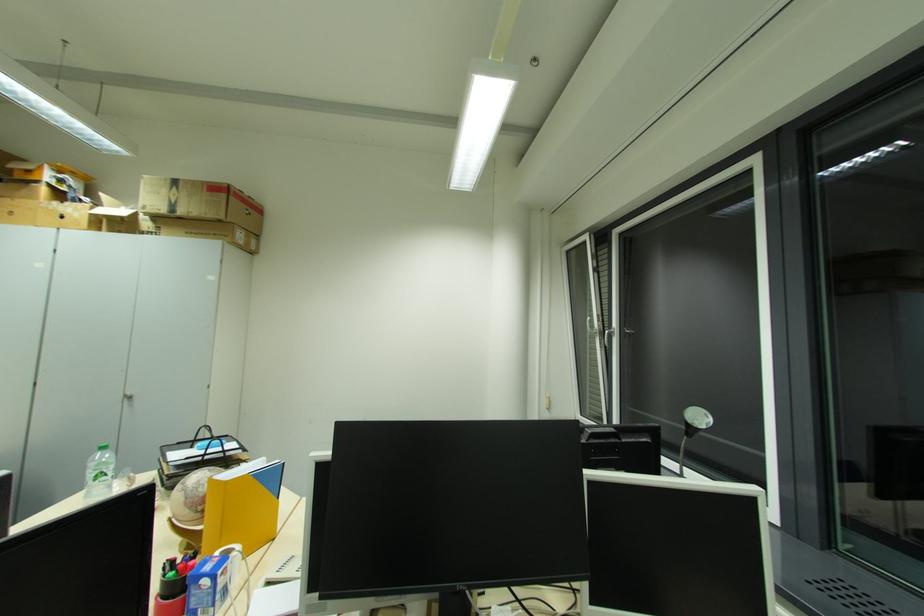
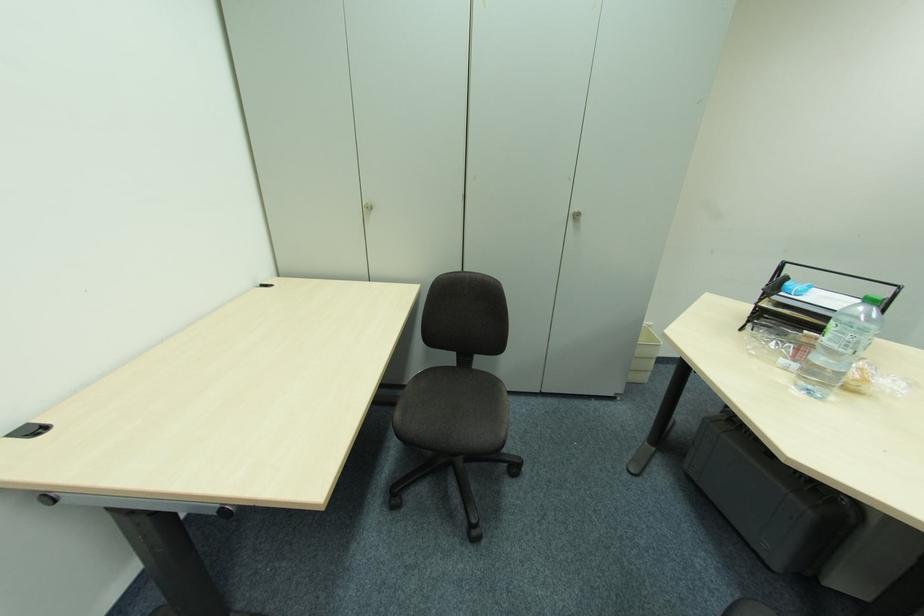
In the second image, find the point that corresponds to (128,400) in the first image.

(574, 219)